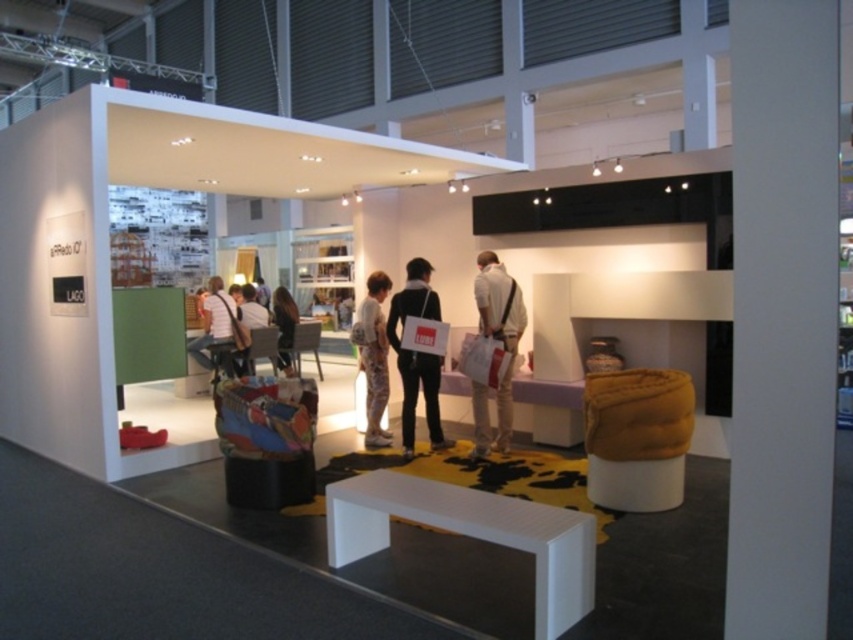
Is point (433, 376) behind point (239, 314)?

No, (433, 376) is closer to viewer.

Is point (405, 320) positioned in front of point (283, 368)?

Yes, point (405, 320) is closer to viewer.

This screenshot has width=853, height=640. What do you see at coordinates (416, 355) in the screenshot? I see `matte black bag at center` at bounding box center [416, 355].

You are a GUI agent. You are given a task and a screenshot of the screen. Output one action in this format:
    pyautogui.click(x=<x>, y=<y>)
    Task: Click on the matte black bag at center
    The width and height of the screenshot is (853, 640).
    Given the screenshot: What is the action you would take?
    click(x=416, y=355)

Can you confirm if matte black bag at center is taller than white fabric shirt at center?

Yes.

Which is below, matte black bag at center or white fabric shirt at center?

matte black bag at center

Image resolution: width=853 pixels, height=640 pixels. Find the location of `matte black bag at center`. matte black bag at center is located at coordinates (416, 355).

Who is positioned more to the left, white smooth pillar at center or white fabric shirt at center?

white fabric shirt at center

Who is more forward, (833, 180) or (242, 314)?

Point (833, 180)

Does point (804, 154) come farther from viewer compared to point (253, 364)?

No, it is in front of (253, 364).

At what (x,y) coordinates should I click in order to perform the action: click on white smooth pillar at center. Please return your answer as a coordinate pair (x, y). The image size is (853, 640). Looking at the image, I should click on (782, 314).